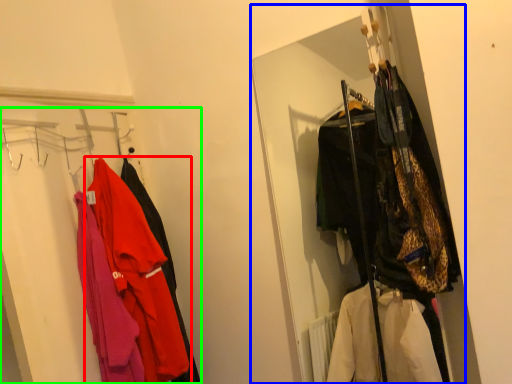
Question: Considering the real-world distances, which object is closest to jacket (highlighted by a red box)? closet (highlighted by a blue box) or closet (highlighted by a green box).

Choices:
 (A) closet
 (B) closet

Answer: (B)